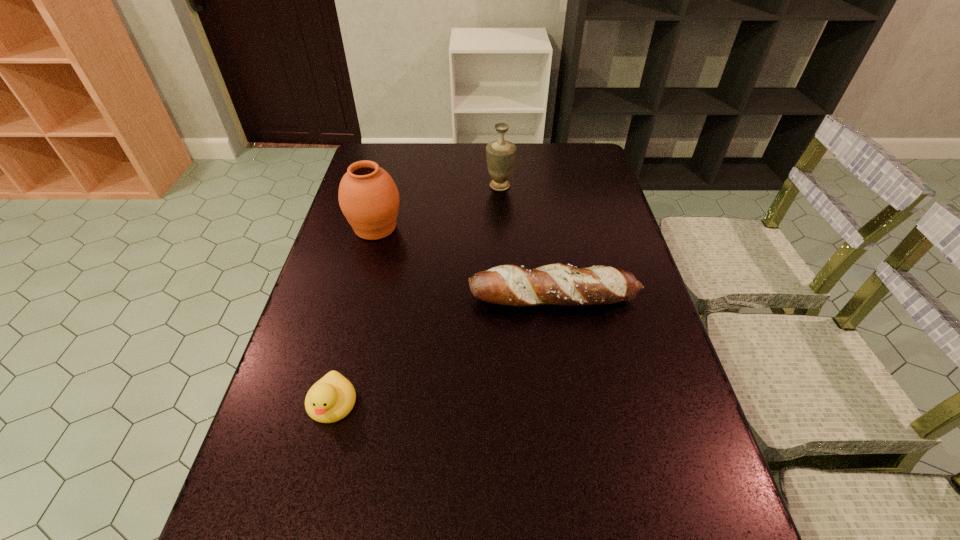
Image resolution: width=960 pixels, height=540 pixels. I want to click on blank region between the nearer urn and the second nearest object, so click(x=465, y=262).

Where is `free space between the farthest object and the baguet`? free space between the farthest object and the baguet is located at coordinates (527, 241).

In order to click on free point between the right urn and the third farthest object in this screenshot , I will do `click(527, 241)`.

Identify the location of empty location between the farthest object and the left urn. (438, 207).

Locate an element on the screen. The image size is (960, 540). vacant area that lies between the duckling and the baguet is located at coordinates (444, 350).

At what (x,y) coordinates should I click in order to perform the action: click on free space between the second farthest object and the right urn. Please return your answer as a coordinate pair (x, y). Looking at the image, I should click on (438, 207).

This screenshot has width=960, height=540. What are the coordinates of `free point between the right urn and the nearer urn` in the screenshot? It's located at (438, 207).

Locate an element on the screen. Image resolution: width=960 pixels, height=540 pixels. vacant point located between the duckling and the baguet is located at coordinates (444, 350).

Identify which object is the closest to the second nearest object. Please provide its 2D coordinates. Your answer should be formatted as a tuple, i.e. [(x, y)], where the tuple contains the x and y coordinates of a point satisfying the conditions above.

[(368, 196)]

Identify the location of object that stands as the second closest to the nearest object. This screenshot has height=540, width=960. (368, 196).